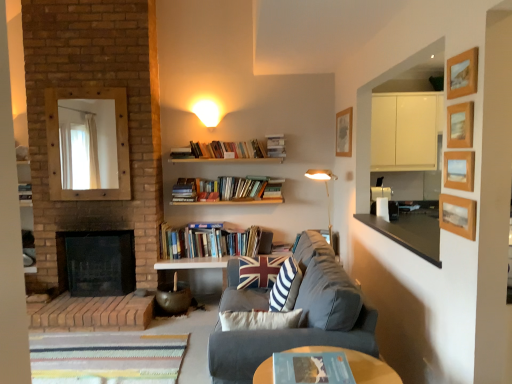
The height and width of the screenshot is (384, 512). I want to click on vacant region above wooden mirror at upper left (from a real-world perspective), so click(83, 89).